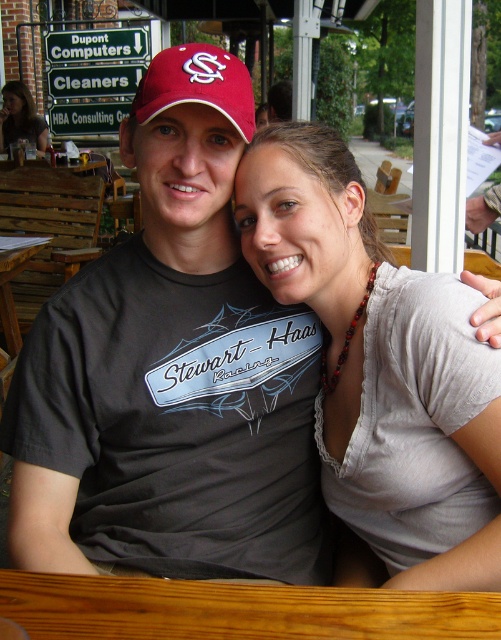
Question: Which of the following is the farthest from the observer?

Choices:
 (A) matte red baseball cap at upper center
 (B) matte black hair at upper left
 (C) brown wooden table at lower left
 (D) matte gray shirt at center

Answer: (B)

Question: Which point appears farthest from the camera in this image?

Choices:
 (A) (464, 440)
 (B) (11, 326)

Answer: (B)

Question: Is matte gray shirt at center bigger than matte black hair at upper left?

Choices:
 (A) no
 (B) yes

Answer: (A)

Question: Is matte gray shirt at center behind matte black hair at upper left?

Choices:
 (A) yes
 (B) no

Answer: (B)

Question: Which object is the closest to the matte gray shirt at center?

Choices:
 (A) matte red baseball cap at upper center
 (B) brown wooden table at lower left

Answer: (A)

Question: Observing the image, what is the correct spatial positioning of matte red baseball cap at upper center in reference to brown wooden table at lower left?

Choices:
 (A) above
 (B) below

Answer: (A)